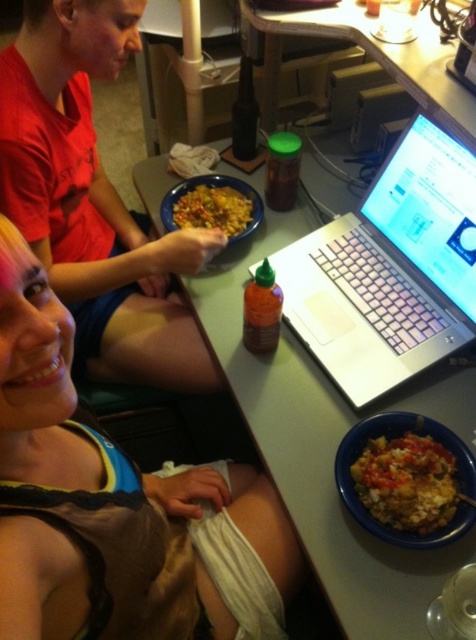
You are a guest at this table and want to grab the yellowish matte rice bowl at lower right without touching the silver metallic laptop at center. Which direction should you reach towards from your current position?

The silver metallic laptop at center is to the left of the yellowish matte rice bowl at lower right, so you should reach towards your right to grab the yellowish matte rice bowl at lower right without disturbing the laptop.

You are standing in front of the table and want to place a small object on the table. You have two points to choose from. The first point is at coordinate point (257, 627) and the second is at point (309, 412). Which point is closer to you?

Point (257, 627) is closer to the camera than point (309, 412), so you should choose the first point as it is closer to you.